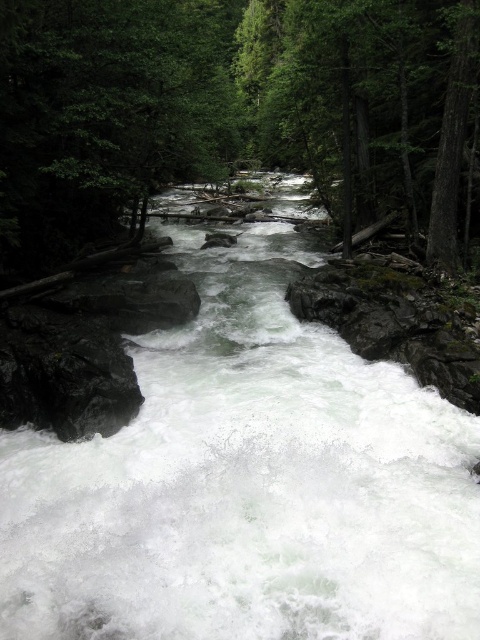
Who is more forward, (439, 621) or (120, 157)?

Positioned in front is point (439, 621).

Consider the image. Does white frothy water at center appear under green matte tree at center?

Yes.

I want to click on white frothy water at center, so click(248, 484).